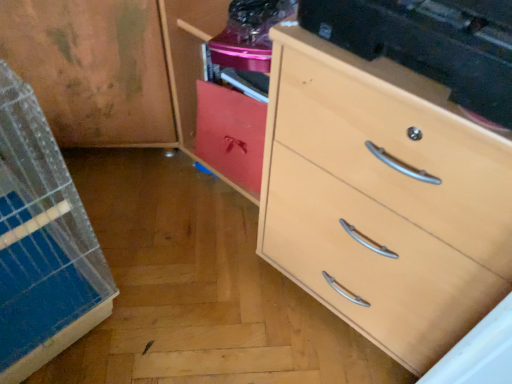
Question: From a real-world perspective, is matte red cabinet at center under light wood chest of drawers at right?

Choices:
 (A) yes
 (B) no

Answer: (A)

Question: From the image's perspective, is matte red cabinet at center located above light wood chest of drawers at right?

Choices:
 (A) yes
 (B) no

Answer: (A)

Question: Is matte red cabinet at center wider than light wood chest of drawers at right?

Choices:
 (A) no
 (B) yes

Answer: (A)

Question: Considering the relative sizes of matte red cabinet at center and light wood chest of drawers at right in the image provided, is matte red cabinet at center shorter than light wood chest of drawers at right?

Choices:
 (A) yes
 (B) no

Answer: (A)

Question: Can you confirm if matte red cabinet at center is smaller than light wood chest of drawers at right?

Choices:
 (A) yes
 (B) no

Answer: (A)

Question: From the image's perspective, is matte red cabinet at center beneath light wood chest of drawers at right?

Choices:
 (A) yes
 (B) no

Answer: (B)

Question: Does light wood chest of drawers at right have a greater width compared to matte red cabinet at center?

Choices:
 (A) yes
 (B) no

Answer: (A)

Question: Is light wood chest of drawers at right outside of matte red cabinet at center?

Choices:
 (A) no
 (B) yes

Answer: (B)

Question: Considering the relative sizes of light wood chest of drawers at right and matte red cabinet at center in the image provided, is light wood chest of drawers at right taller than matte red cabinet at center?

Choices:
 (A) no
 (B) yes

Answer: (B)

Question: Does light wood chest of drawers at right come in front of matte red cabinet at center?

Choices:
 (A) no
 (B) yes

Answer: (B)

Question: Considering the relative sizes of light wood chest of drawers at right and matte red cabinet at center in the image provided, is light wood chest of drawers at right bigger than matte red cabinet at center?

Choices:
 (A) no
 (B) yes

Answer: (B)

Question: Is light wood chest of drawers at right surrounding matte red cabinet at center?

Choices:
 (A) yes
 (B) no

Answer: (B)

Question: Considering the positions of matte red cabinet at center and light wood chest of drawers at right in the image, is matte red cabinet at center bigger or smaller than light wood chest of drawers at right?

Choices:
 (A) small
 (B) big

Answer: (A)